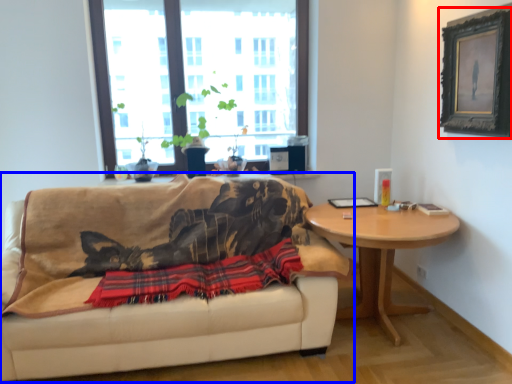
Question: Which of the following is the closest to the observer, picture frame (highlighted by a red box) or studio couch (highlighted by a blue box)?

Choices:
 (A) picture frame
 (B) studio couch

Answer: (B)